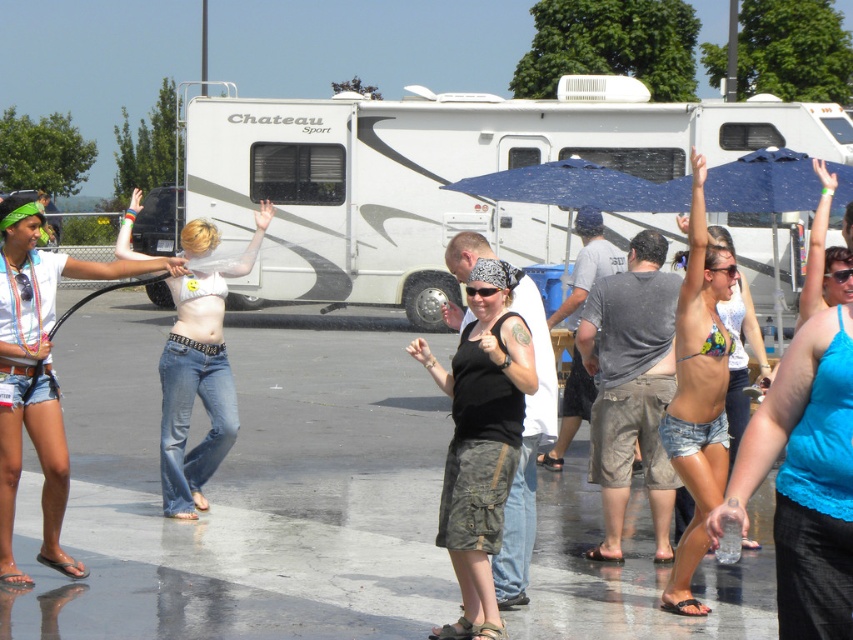
You are a photographer trying to capture the scene. You want to ensure both the denim shorts at lower left and the printed bikini top at center are in the frame. Which object should you position closer to the left side of your camera viewfinder to include both?

You should position the denim shorts at lower left closer to the left side of your camera viewfinder since it is already to the left of the printed bikini top at center, ensuring both remain in frame.

You are a photographer trying to capture a detailed shot of both the blue lace tank top at upper right and the printed bikini top at center. Since you want to focus on the smaller one first, which one should you adjust your camera settings for?

The blue lace tank top at upper right occupies less space than the printed bikini top at center, so you should adjust your camera settings for the blue lace tank top at upper right first as it is smaller.